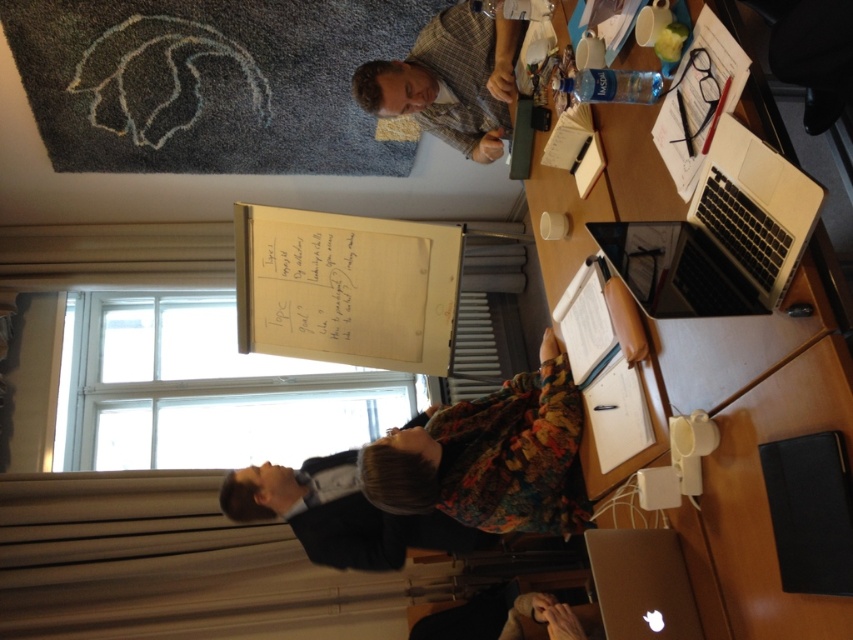
Does plaid fabric shirt at upper center have a smaller size compared to silver metallic laptop at lower right?

Incorrect, plaid fabric shirt at upper center is not smaller in size than silver metallic laptop at lower right.

This screenshot has width=853, height=640. Describe the element at coordinates (451, 77) in the screenshot. I see `plaid fabric shirt at upper center` at that location.

Locate an element on the screen. The width and height of the screenshot is (853, 640). plaid fabric shirt at upper center is located at coordinates (451, 77).

Does floral fabric dress at lower center lie behind silver metallic laptop at lower right?

That is True.

In the scene shown: Is floral fabric dress at lower center to the left of silver metallic laptop at lower right from the viewer's perspective?

Correct, you'll find floral fabric dress at lower center to the left of silver metallic laptop at lower right.

Which is in front, point (543, 532) or point (670, 564)?

Point (670, 564) is in front.

Locate an element on the screen. The image size is (853, 640). floral fabric dress at lower center is located at coordinates (490, 456).

This screenshot has width=853, height=640. Describe the element at coordinates (756, 449) in the screenshot. I see `white paper at upper center` at that location.

Can you confirm if white paper at upper center is taller than plaid fabric shirt at upper center?

Yes.

Is point (741, 552) positioned before point (471, 20)?

Yes, point (741, 552) is in front of point (471, 20).

What are the coordinates of `white paper at upper center` in the screenshot? It's located at pyautogui.click(x=756, y=449).